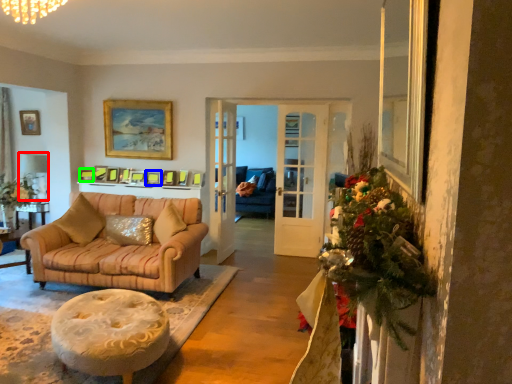
Question: Estimate the real-world distances between objects in this image. Which object is closer to lamp (highlighted by a red box), picture frame (highlighted by a blue box) or picture frame (highlighted by a green box)?

Choices:
 (A) picture frame
 (B) picture frame

Answer: (B)